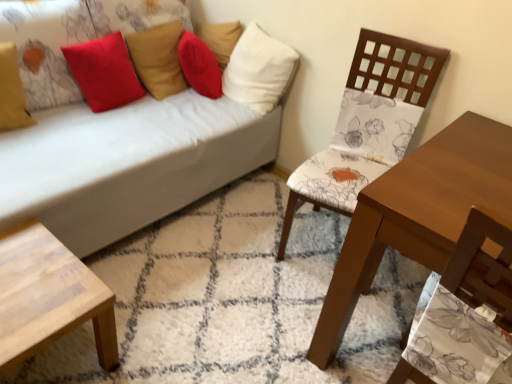
This screenshot has width=512, height=384. I want to click on free spot to the left of floral fabric chair at center right, so click(x=243, y=234).